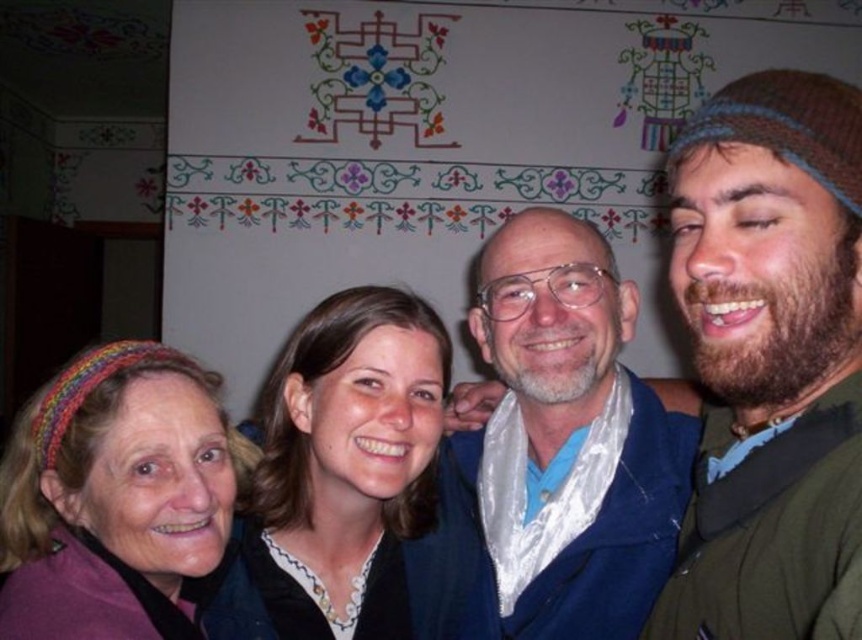
Question: Which of the following is the farthest from the observer?

Choices:
 (A) multicolored knitted headband at left
 (B) smooth brown hair at center
 (C) blue fabric at center

Answer: (C)

Question: Which of the following is the farthest from the observer?

Choices:
 (A) bearded man at center
 (B) blue fabric at center
 (C) smooth brown hair at center
 (D) multicolored knitted headband at left

Answer: (B)

Question: Is bearded man at center above blue fabric at center?

Choices:
 (A) no
 (B) yes

Answer: (B)

Question: Can you confirm if blue fabric at center is smaller than smooth brown hair at center?

Choices:
 (A) yes
 (B) no

Answer: (B)

Question: Which object is positioned farthest from the blue fabric at center?

Choices:
 (A) smooth brown hair at center
 (B) multicolored knitted headband at left

Answer: (B)

Question: Does bearded man at center appear under smooth brown hair at center?

Choices:
 (A) no
 (B) yes

Answer: (A)